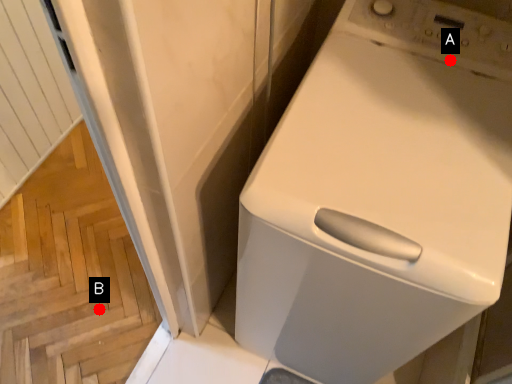
Question: Two points are circled on the image, labeled by A and B beside each circle. Which point is farther from the camera taking this photo?

Choices:
 (A) A is further
 (B) B is further

Answer: (B)